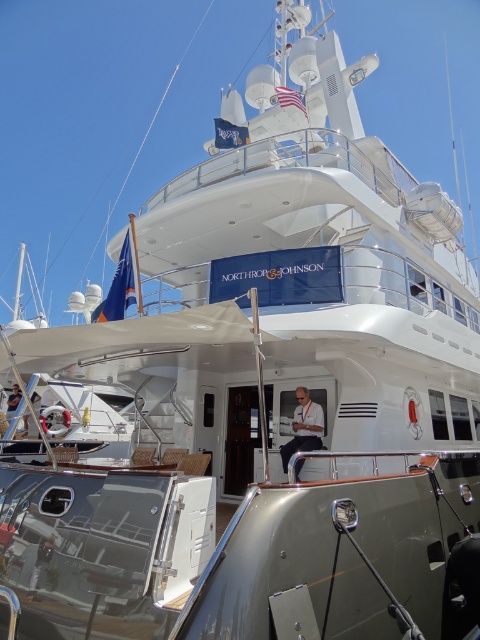
Measure the distance between point (296,438) and camera.

They are 5.96 meters apart.

The width and height of the screenshot is (480, 640). Find the location of `white fabric shirt at center`. white fabric shirt at center is located at coordinates (303, 428).